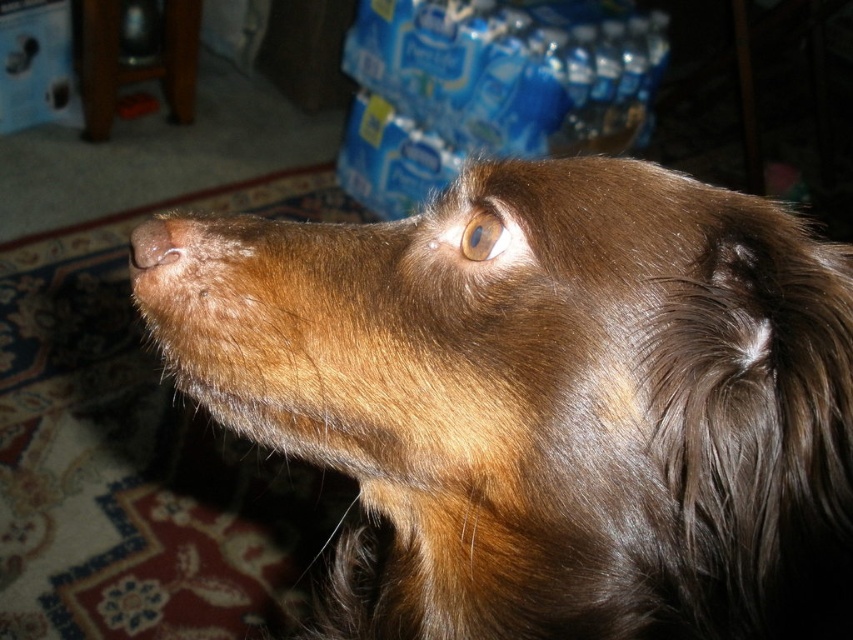
Question: Which object is farther from the camera taking this photo?

Choices:
 (A) brown fur at center
 (B) brown glossy eye at upper center

Answer: (A)

Question: Which of these objects is positioned closest to the shiny brown fur at upper center?

Choices:
 (A) brown fur at center
 (B) brown glossy eye at upper center

Answer: (B)

Question: Is brown glossy eye at upper center closer to camera compared to brown fur at center?

Choices:
 (A) yes
 (B) no

Answer: (A)

Question: Can you confirm if shiny brown fur at upper center is thinner than brown glossy eye at upper center?

Choices:
 (A) yes
 (B) no

Answer: (B)

Question: Is shiny brown fur at upper center bigger than brown fur at center?

Choices:
 (A) yes
 (B) no

Answer: (A)

Question: Which point is farther to the camera?

Choices:
 (A) (164, 253)
 (B) (494, 224)
 (C) (384, 432)

Answer: (A)